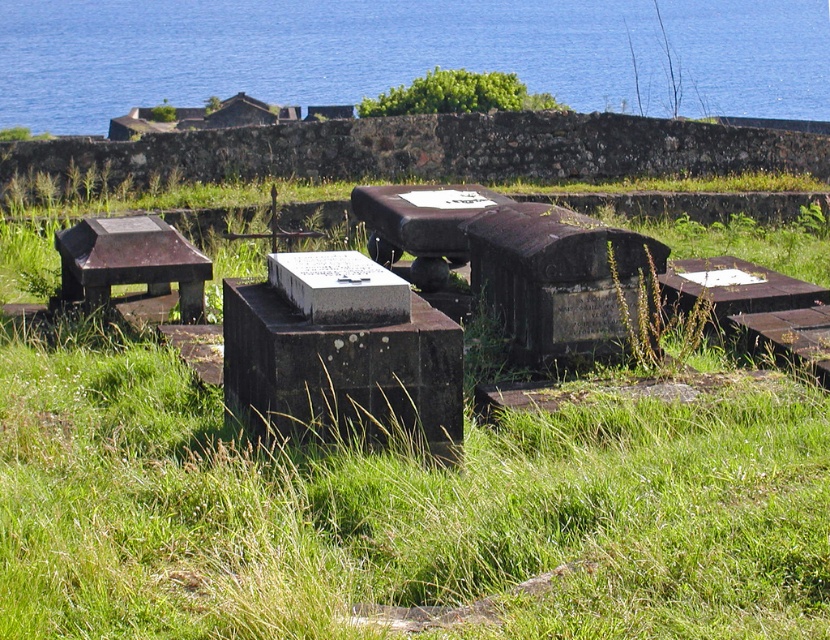
Does blue water at upper center appear over rustic wood bench at left?

Yes.

Is blue water at upper center below rustic wood bench at left?

No, blue water at upper center is not below rustic wood bench at left.

Who is more forward, (150,8) or (83,284)?

Positioned in front is point (83,284).

The width and height of the screenshot is (830, 640). In order to click on blue water at upper center in this screenshot , I will do `click(311, 52)`.